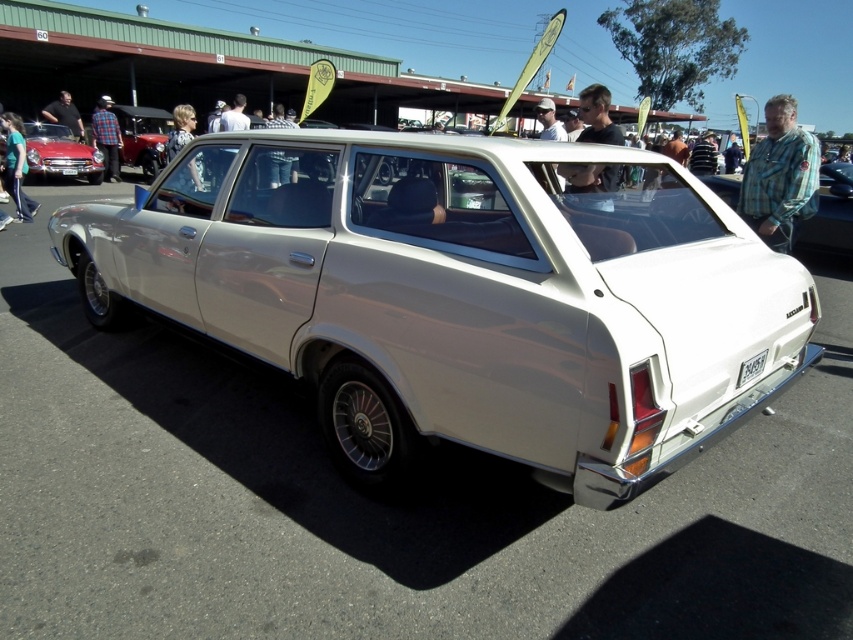
Between matte white station wagon at center and light brown hair at center, which one is positioned higher?

Positioned higher is light brown hair at center.

Does matte white station wagon at center have a lesser height compared to light brown hair at center?

Correct, matte white station wagon at center is not as tall as light brown hair at center.

Is point (712, 195) positioned after point (175, 179)?

No.

You are a GUI agent. You are given a task and a screenshot of the screen. Output one action in this format:
    pyautogui.click(x=<x>, y=<y>)
    Task: Click on the matte white station wagon at center
    This screenshot has height=640, width=853.
    Given the screenshot: What is the action you would take?
    pyautogui.click(x=463, y=296)

From the picture: Who is positioned more to the right, matte white station wagon at center or matte black shirt at left?

From the viewer's perspective, matte white station wagon at center appears more on the right side.

Find the location of `matte white station wagon at center`. matte white station wagon at center is located at coordinates (463, 296).

In order to click on matte white station wagon at center in this screenshot , I will do `click(463, 296)`.

Between plaid shirt at left and white plastic license plate at lower center, which one appears on the right side from the viewer's perspective?

Positioned to the right is white plastic license plate at lower center.

Does plaid shirt at left have a lesser width compared to white plastic license plate at lower center?

Incorrect, plaid shirt at left's width is not less than white plastic license plate at lower center's.

You are a GUI agent. You are given a task and a screenshot of the screen. Output one action in this format:
    pyautogui.click(x=<x>, y=<y>)
    Task: Click on the plaid shirt at left
    The image size is (853, 640).
    Given the screenshot: What is the action you would take?
    pyautogui.click(x=106, y=138)

Identify the location of plaid shirt at left. (106, 138).